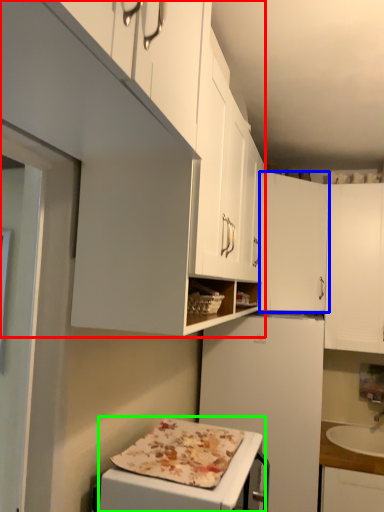
Question: Estimate the real-world distances between objects in this image. Which object is closer to cabinetry (highlighted by a red box), cabinetry (highlighted by a blue box) or appliance (highlighted by a green box)?

Choices:
 (A) cabinetry
 (B) appliance

Answer: (B)